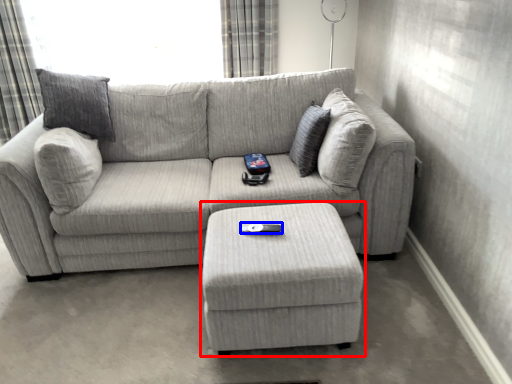
Question: Among these objects, which one is nearest to the camera, table (highlighted by a red box) or remote (highlighted by a blue box)?

Choices:
 (A) table
 (B) remote

Answer: (A)